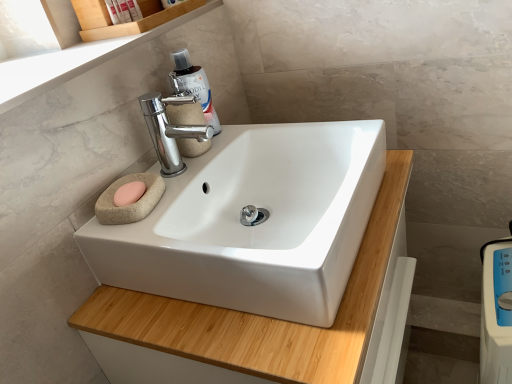
Question: From the image's perspective, is white plastic scale at lower right located beneath matte plastic soap at upper left, which is the 1th toiletry in left-to-right order?

Choices:
 (A) yes
 (B) no

Answer: (A)

Question: From a real-world perspective, is white plastic scale at lower right on top of matte plastic soap at upper left, which is the 1th toiletry in left-to-right order?

Choices:
 (A) no
 (B) yes

Answer: (A)

Question: From a real-world perspective, is white plastic scale at lower right positioned under matte plastic soap at upper left, which is the 1th toiletry in left-to-right order, based on gravity?

Choices:
 (A) no
 (B) yes

Answer: (B)

Question: Is white plastic scale at lower right outside matte plastic soap at upper left, the second toiletry when ordered from right to left?

Choices:
 (A) no
 (B) yes

Answer: (B)

Question: Is white plastic scale at lower right aimed at matte plastic soap at upper left, which is the 1th toiletry in left-to-right order?

Choices:
 (A) no
 (B) yes

Answer: (A)

Question: Is white plastic scale at lower right positioned behind matte plastic soap at upper left, the second toiletry when ordered from right to left?

Choices:
 (A) no
 (B) yes

Answer: (A)

Question: Is white plastic bottle at upper left, acting as the 2th toiletry starting from the left, to the left of white glossy sink at center from the viewer's perspective?

Choices:
 (A) yes
 (B) no

Answer: (A)

Question: Considering the relative sizes of white plastic bottle at upper left, acting as the 2th toiletry starting from the left, and white glossy sink at center in the image provided, is white plastic bottle at upper left, acting as the 2th toiletry starting from the left, thinner than white glossy sink at center?

Choices:
 (A) no
 (B) yes

Answer: (B)

Question: Is white glossy sink at center at the back of white plastic bottle at upper left, placed as the first toiletry when sorted from right to left?

Choices:
 (A) yes
 (B) no

Answer: (B)

Question: Considering the relative sizes of white plastic bottle at upper left, placed as the first toiletry when sorted from right to left, and white glossy sink at center in the image provided, is white plastic bottle at upper left, placed as the first toiletry when sorted from right to left, wider than white glossy sink at center?

Choices:
 (A) no
 (B) yes

Answer: (A)

Question: Is white plastic bottle at upper left, acting as the 2th toiletry starting from the left, oriented towards white glossy sink at center?

Choices:
 (A) no
 (B) yes

Answer: (A)

Question: From the image's perspective, is white plastic bottle at upper left, acting as the 2th toiletry starting from the left, located above white glossy sink at center?

Choices:
 (A) no
 (B) yes

Answer: (B)

Question: Is translucent plastic bottle at upper center further to camera compared to matte plastic soap at upper left, which is the 1th toiletry in left-to-right order?

Choices:
 (A) no
 (B) yes

Answer: (A)